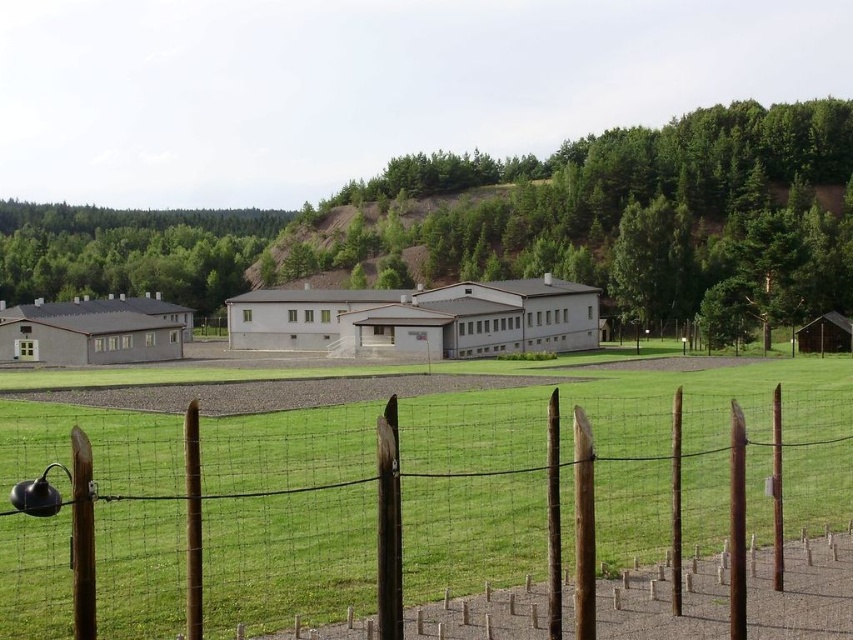
Between green leafy tree at center and white matte building at center, which one appears on the right side from the viewer's perspective?

From the viewer's perspective, white matte building at center appears more on the right side.

Which is above, green leafy tree at center or white matte building at center?

Positioned higher is green leafy tree at center.

Who is more distant from viewer, (689, 314) or (579, 300)?

The point (689, 314) is more distant.

Identify the location of green leafy tree at center. (517, 224).

Is green leafy tree at center bigger than green leafy tree at upper left?

Yes.

Is green leafy tree at center taller than green leafy tree at upper left?

Yes.

Locate an element on the screen. green leafy tree at center is located at coordinates [517, 224].

The width and height of the screenshot is (853, 640). I want to click on green leafy tree at center, so click(x=517, y=224).

Does point (525, 307) come in front of point (30, 241)?

Yes, point (525, 307) is in front of point (30, 241).

Does white matte building at center have a larger size compared to green leafy tree at upper left?

No, white matte building at center is not bigger than green leafy tree at upper left.

The height and width of the screenshot is (640, 853). Describe the element at coordinates (421, 317) in the screenshot. I see `white matte building at center` at that location.

Locate an element on the screen. white matte building at center is located at coordinates (421, 317).